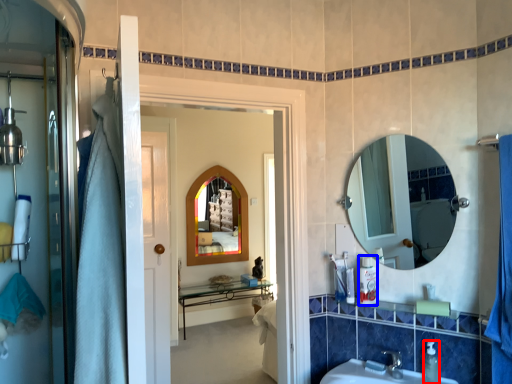
Question: Among these objects, which one is nearest to the camera, toiletry (highlighted by a red box) or toiletry (highlighted by a blue box)?

Choices:
 (A) toiletry
 (B) toiletry

Answer: (A)